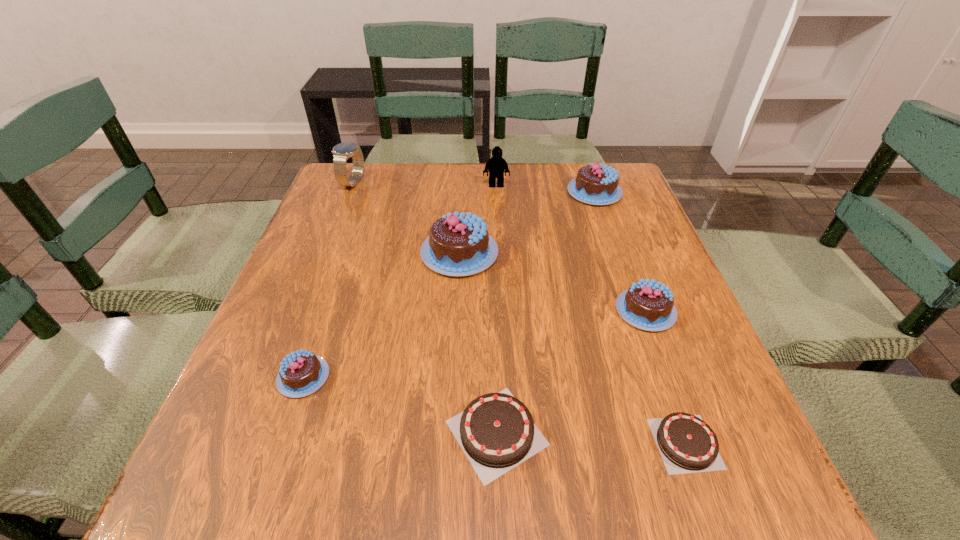
Locate an element on the screen. The height and width of the screenshot is (540, 960). pink chocolate cake that stands as the second closest to the second farthest chocolate cake is located at coordinates (648, 305).

The image size is (960, 540). Identify the location of free spot that satisfies the following two spatial constraints: 1. on the back side of the fifth farthest object; 2. on the right side of the shortest object. (638, 310).

The height and width of the screenshot is (540, 960). Identify the location of free space that satisfies the following two spatial constraints: 1. on the face of the Lego; 2. on the left side of the farthest pink chocolate cake. (496, 192).